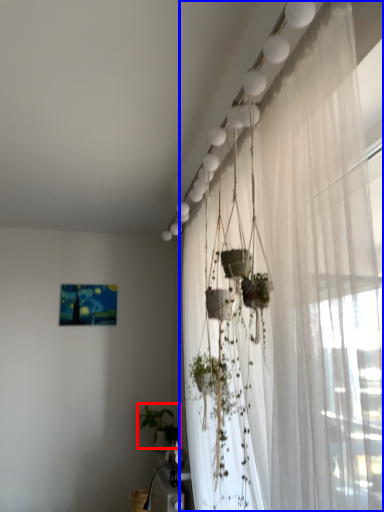
Question: Which of the following is the closest to the observer, plant (highlighted by a red box) or curtain (highlighted by a blue box)?

Choices:
 (A) plant
 (B) curtain

Answer: (B)